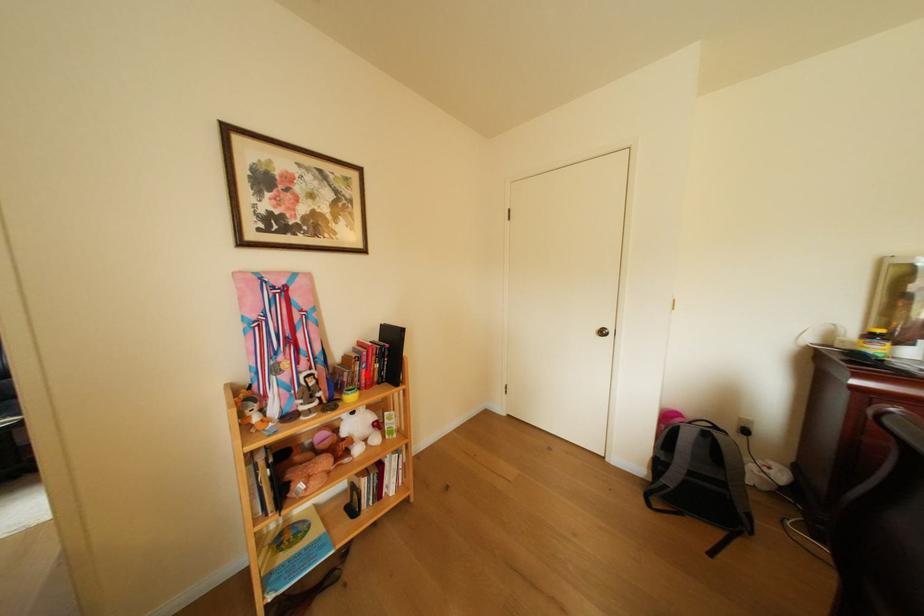
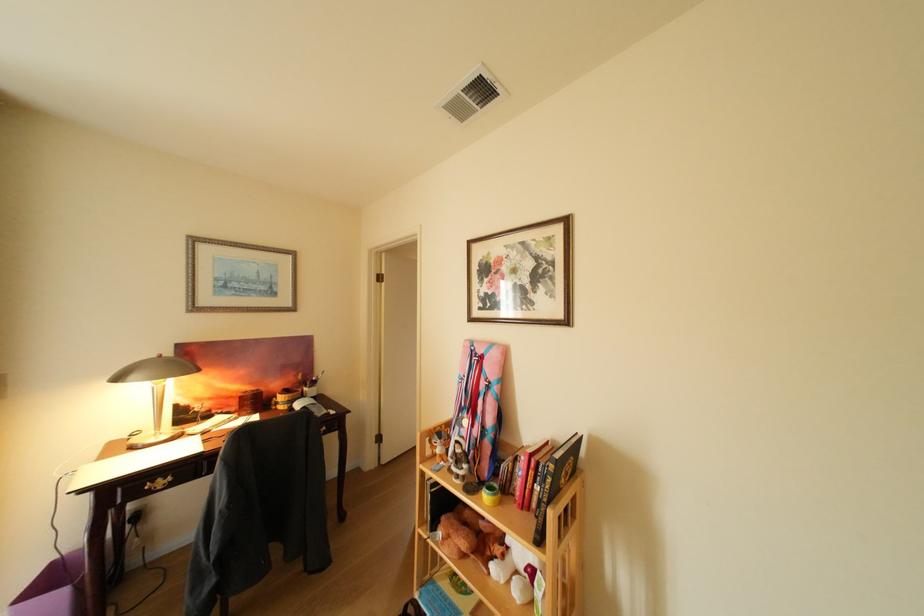
In the second image, find the point that corresponds to the highlighted location in the first image.

(525, 475)